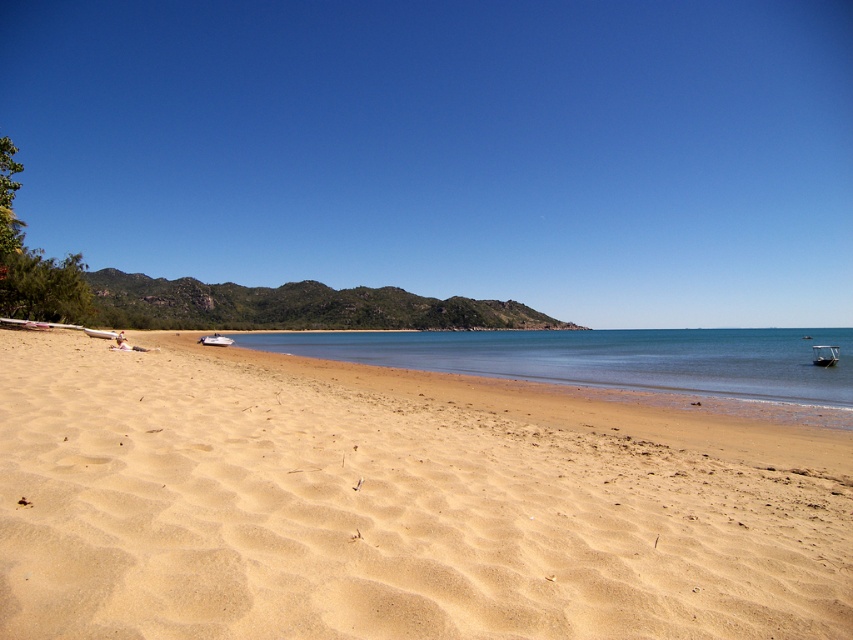
You are standing on the beach and want to reach the clear blue water at center. Based on the scene description, which direction should you walk to reach the water?

The clear blue water at center is located at point coordinates, so you should walk towards the center of the beach to reach the clear blue water at center.

You are standing at the edge of the beach and want to walk to the white plastic boat at lower left without getting your shoes wet. The clear blue water at center is between you and the boat. Do you think you can reach the boat without stepping into the water?

The clear blue water at center might be wider than white plastic boat at lower left, so it is possible that the water is too wide to cross without getting wet. You might need to take a detour around the water to reach the boat safely.